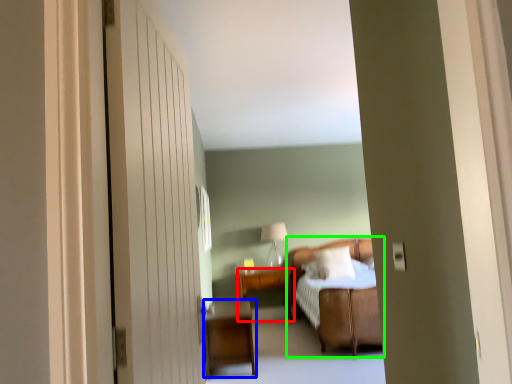
Question: Which is farther away from table (highlighted by a red box)? nightstand (highlighted by a blue box) or bed (highlighted by a green box)?

Choices:
 (A) nightstand
 (B) bed

Answer: (A)